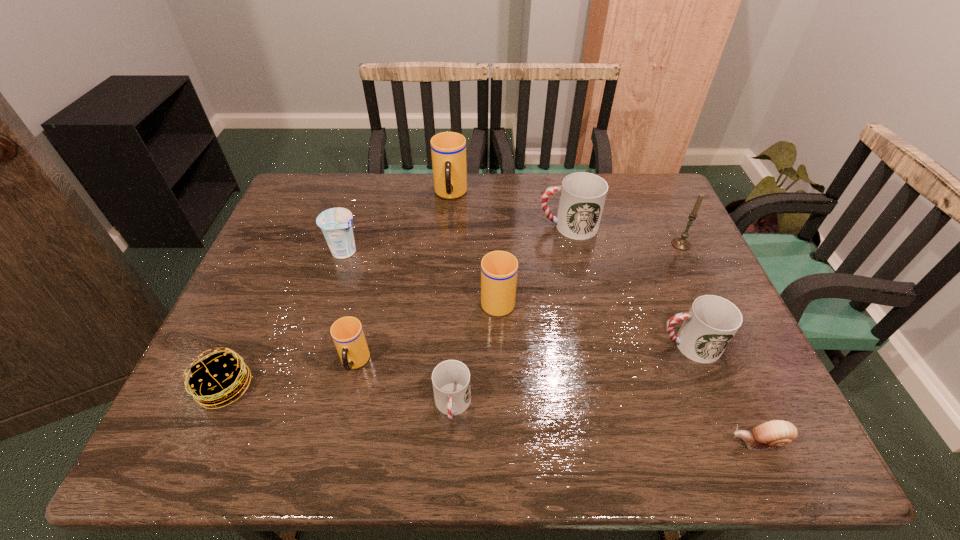
Find the location of a particular element. This screenshot has height=540, width=960. the second beige cup from left to right is located at coordinates (448, 149).

At what (x,y) coordinates should I click in order to perform the action: click on the farthest object. Please return your answer as a coordinate pair (x, y). The width and height of the screenshot is (960, 540). Looking at the image, I should click on (448, 149).

This screenshot has width=960, height=540. I want to click on candle, so click(681, 243).

Find the location of a particular element. The image size is (960, 540). the second cup from right to left is located at coordinates (582, 195).

This screenshot has width=960, height=540. In order to click on the biggest red cup in this screenshot , I will do `click(582, 195)`.

At what (x,y) coordinates should I click in order to perform the action: click on the second farthest beige cup. Please return your answer as a coordinate pair (x, y). Looking at the image, I should click on (499, 269).

I want to click on the fifth object from right to left, so click(499, 269).

Where is `blue yogurt`? This screenshot has height=540, width=960. blue yogurt is located at coordinates (336, 224).

Identify the location of the ninth object from right to left. (336, 224).

Locate an element on the screen. Image resolution: width=960 pixels, height=540 pixels. the second nearest red cup is located at coordinates (712, 321).